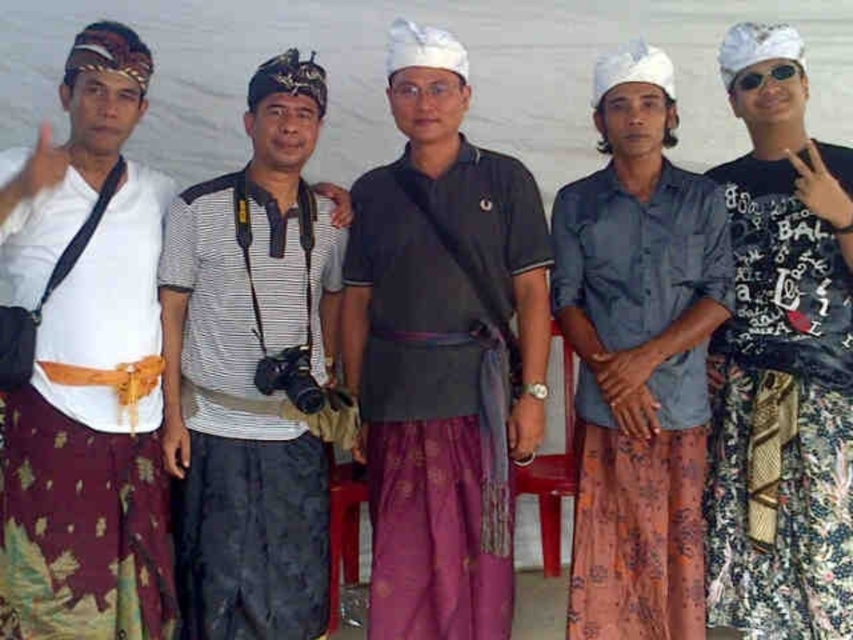
Does striped cotton shirt at center appear under blue cotton shirt at center?

Indeed, striped cotton shirt at center is positioned under blue cotton shirt at center.

Based on the photo, how distant is striped cotton shirt at center from blue cotton shirt at center?

striped cotton shirt at center is 91.99 centimeters from blue cotton shirt at center.

Is point (219, 520) farther from camera compared to point (558, 202)?

No, it is in front of (558, 202).

The width and height of the screenshot is (853, 640). What are the coordinates of `striped cotton shirt at center` in the screenshot? It's located at (251, 372).

What do you see at coordinates (637, 358) in the screenshot? I see `blue cotton shirt at center` at bounding box center [637, 358].

This screenshot has height=640, width=853. In order to click on blue cotton shirt at center in this screenshot , I will do `click(637, 358)`.

Describe the element at coordinates (637, 358) in the screenshot. I see `blue cotton shirt at center` at that location.

I want to click on blue cotton shirt at center, so click(637, 358).

Is dark gray cotton shirt at center below sunglasses at right?

Yes.

Who is higher up, dark gray cotton shirt at center or sunglasses at right?

sunglasses at right is higher up.

At what (x,y) coordinates should I click in order to perform the action: click on dark gray cotton shirt at center. Please return your answer as a coordinate pair (x, y). Looking at the image, I should click on (442, 353).